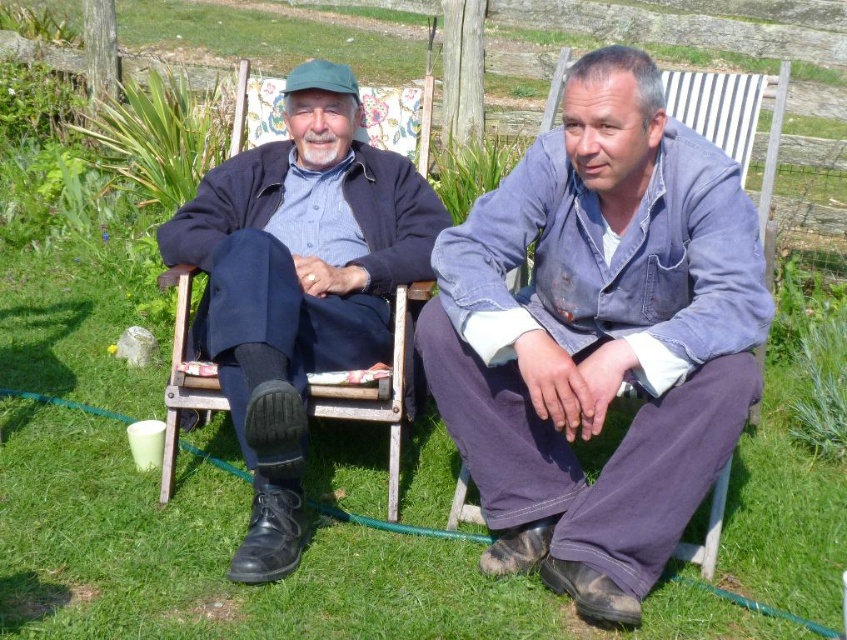
This screenshot has width=847, height=640. What do you see at coordinates (599, 337) in the screenshot?
I see `denim jacket at center` at bounding box center [599, 337].

Is denim jacket at center shorter than matte black jacket at left?

Correct, denim jacket at center is not as tall as matte black jacket at left.

Is point (734, 236) more distant than point (258, 284)?

No, (734, 236) is closer to viewer.

At what (x,y) coordinates should I click in order to perform the action: click on denim jacket at center. Please return your answer as a coordinate pair (x, y). The width and height of the screenshot is (847, 640). Looking at the image, I should click on (599, 337).